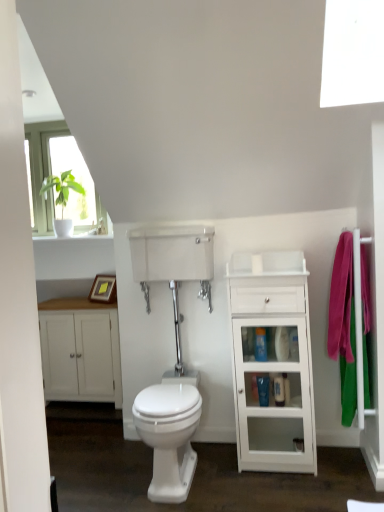
The height and width of the screenshot is (512, 384). Identify the location of vacant area that lies between white glossy bidet at center and white glossy cabinet at right. (237, 480).